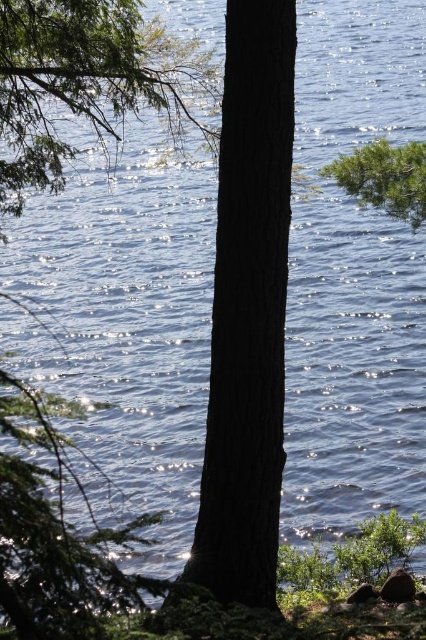
Is smooth bark tree at center shorter than green matte tree trunk at center?

In fact, smooth bark tree at center may be taller than green matte tree trunk at center.

Who is more forward, (275, 244) or (198, 125)?

Point (275, 244)

Where is `smooth bark tree at center`? This screenshot has height=640, width=426. smooth bark tree at center is located at coordinates (247, 310).